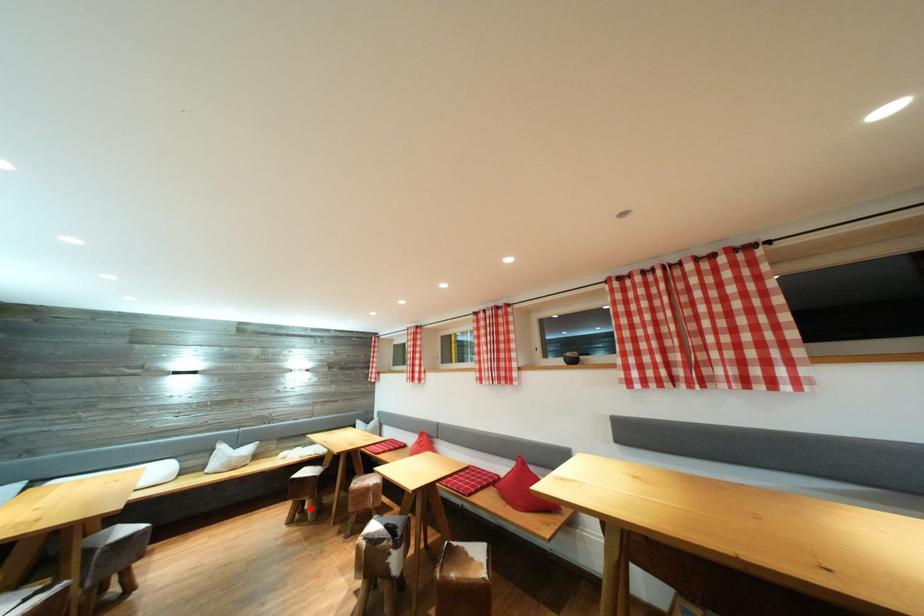
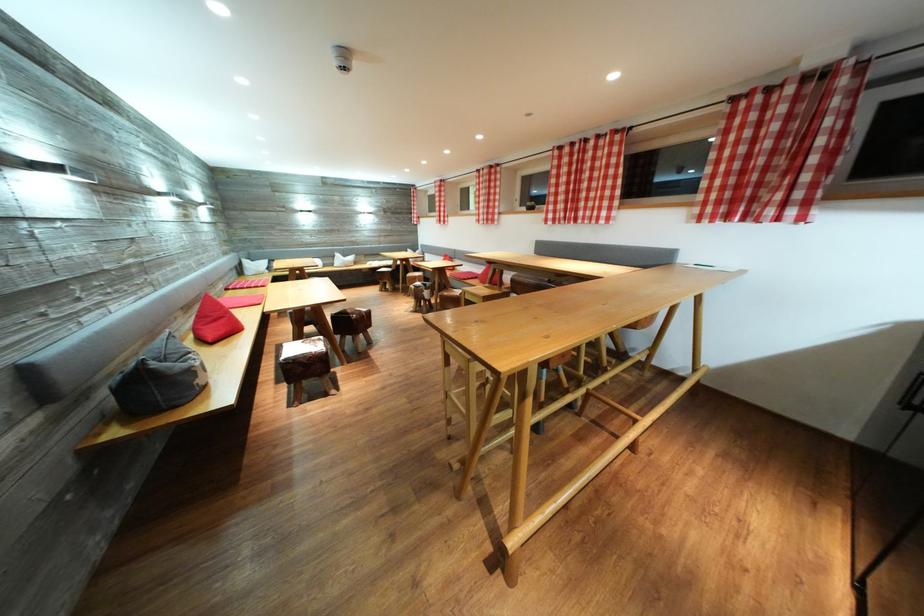
Locate, in the second image, the point that corresponds to the highlighted location in the first image.

(393, 289)